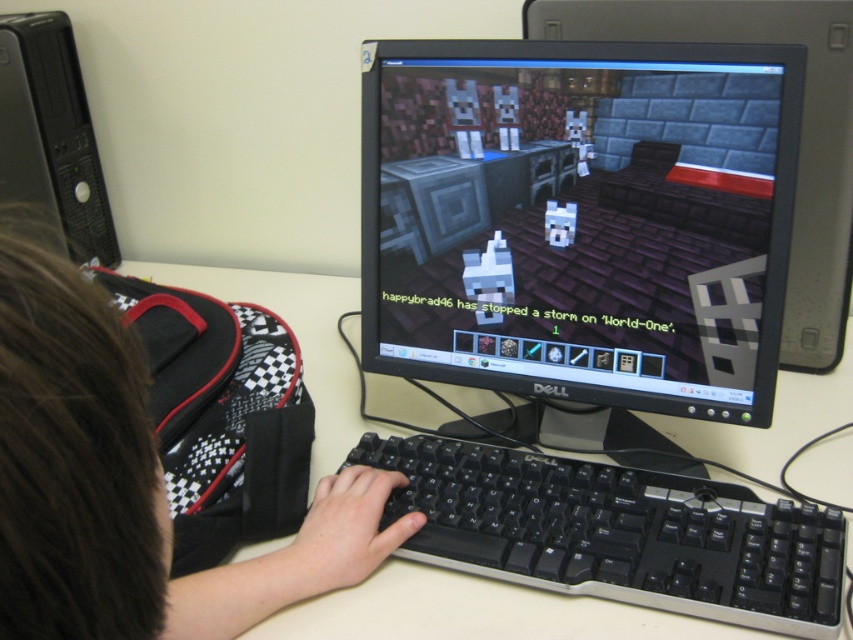
Is brown hair at upper left below black glossy monitor at center?

Yes, brown hair at upper left is below black glossy monitor at center.

Is brown hair at upper left further to the viewer compared to black glossy monitor at center?

No.

Between point (24, 380) and point (764, 42), which one is positioned in front?

Point (24, 380)

Where is `brown hair at upper left`? The image size is (853, 640). brown hair at upper left is located at coordinates pos(129,484).

From the picture: Can you confirm if black matte monitor at center is wider than black glossy monitor at center?

In fact, black matte monitor at center might be narrower than black glossy monitor at center.

Can you confirm if black matte monitor at center is positioned below black glossy monitor at center?

Yes.

Does point (621, 368) lie in front of point (556, 20)?

Yes, it is.

Find the location of a particular element. This screenshot has height=640, width=853. black matte monitor at center is located at coordinates (579, 218).

In the scene shown: Can you confirm if black plastic keyboard at center is bigger than black glossy monitor at center?

Incorrect, black plastic keyboard at center is not larger than black glossy monitor at center.

In order to click on black plastic keyboard at center in this screenshot , I will do `click(616, 532)`.

Find the location of a particular element. black plastic keyboard at center is located at coordinates (616, 532).